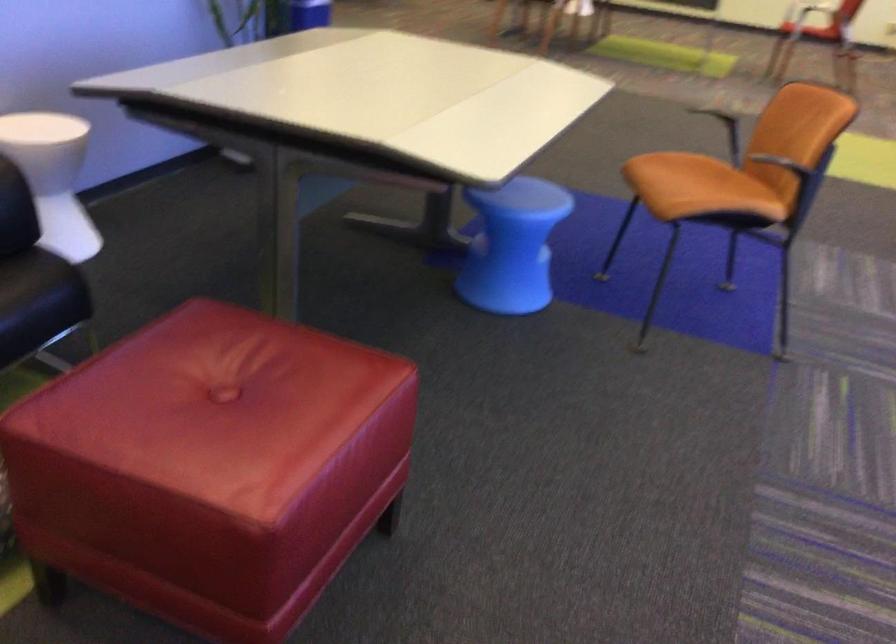
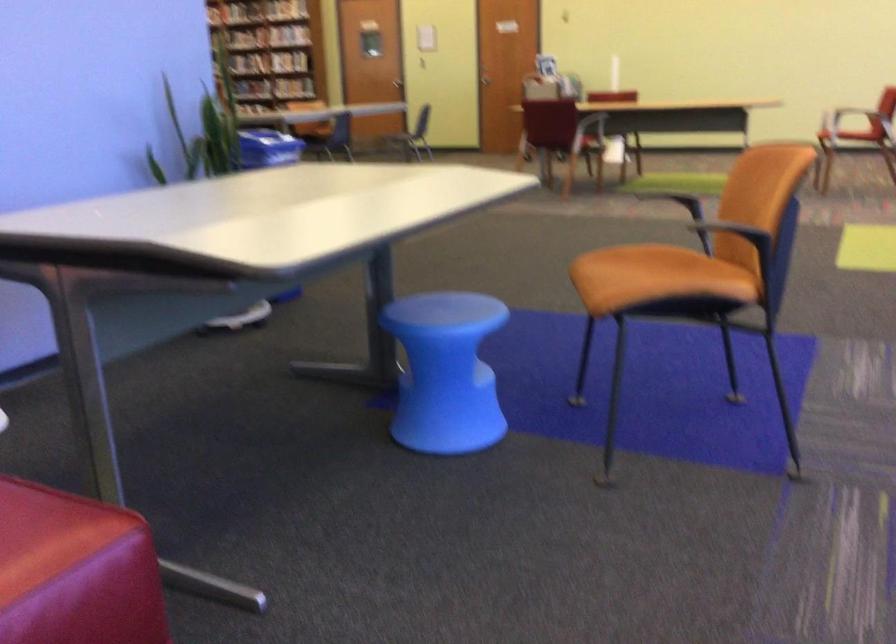
The point at (721, 180) is marked in the first image. Where is the corresponding point in the second image?

(682, 270)